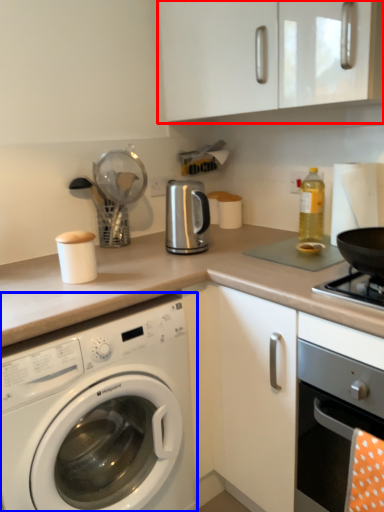
Question: Among these objects, which one is nearest to the camera, cabinetry (highlighted by a red box) or washing machine (highlighted by a blue box)?

Choices:
 (A) cabinetry
 (B) washing machine

Answer: (B)